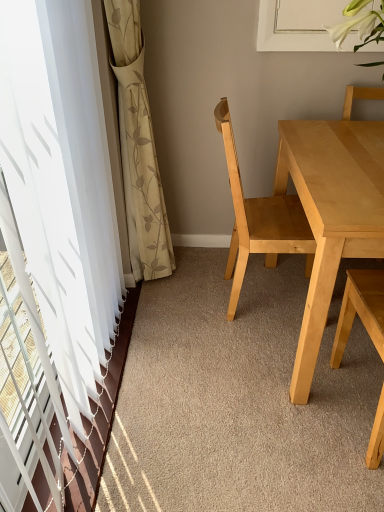
The height and width of the screenshot is (512, 384). In order to click on empty space that is in between beige floral fabric curtain at left and light wood chair at center, the 2th chair in the right-to-left sequence in this screenshot , I will do `click(198, 286)`.